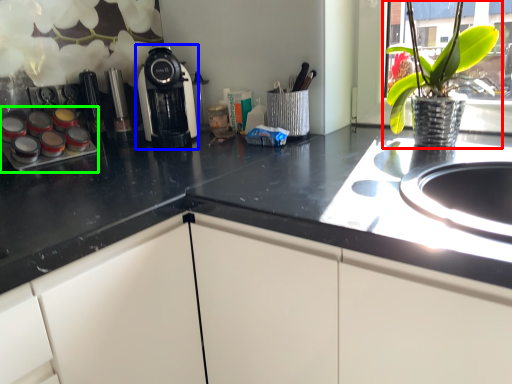
Question: Which is farther away from houseplant (highlighted by a red box)? kitchen appliance (highlighted by a blue box) or appliance (highlighted by a green box)?

Choices:
 (A) kitchen appliance
 (B) appliance

Answer: (B)